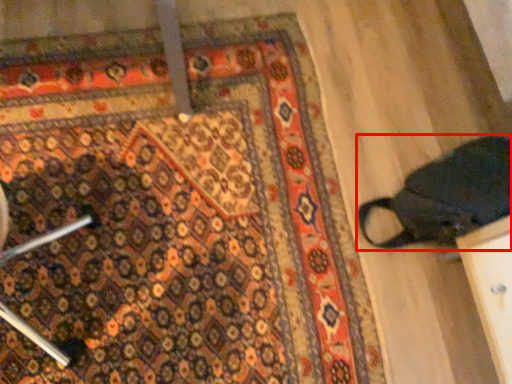
Question: From the image's perspective, what is the correct spatial relationship of footwear (annotated by the red box) in relation to mat?

Choices:
 (A) above
 (B) below

Answer: (A)